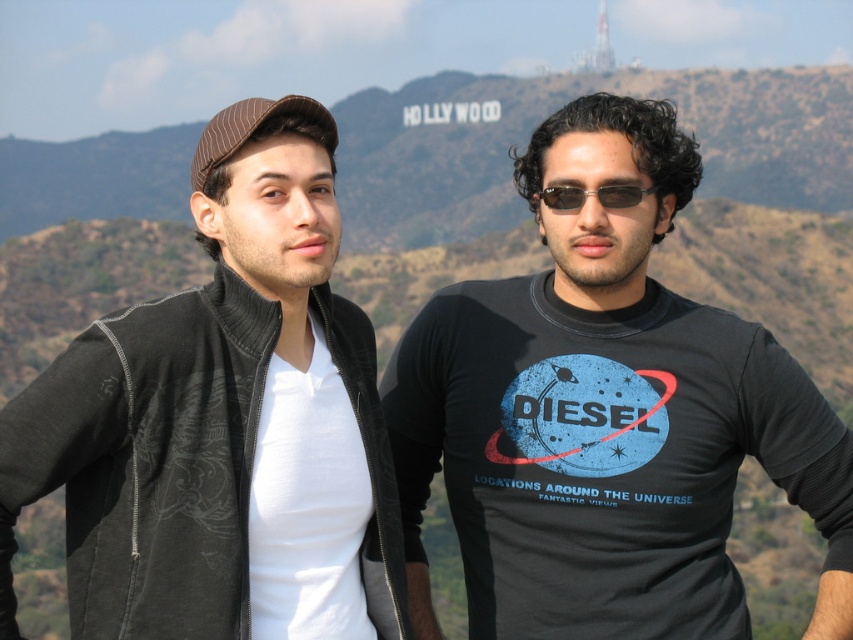
Question: Can you confirm if brownmaterialmountain at upper center is positioned below sunglasses at center?

Choices:
 (A) no
 (B) yes

Answer: (A)

Question: Which object is positioned farthest from the white matte t-shirt at left?

Choices:
 (A) black matte t-shirt at center
 (B) matte black jacket at left
 (C) sunglasses at center

Answer: (C)

Question: Is matte black jacket at left closer to the viewer compared to brownmaterialmountain at upper center?

Choices:
 (A) yes
 (B) no

Answer: (A)

Question: Which point is farther from the camera taking this photo?

Choices:
 (A) (332, 608)
 (B) (213, 557)
 (C) (605, 198)
 (D) (375, 196)

Answer: (D)

Question: Which point is closer to the camera?

Choices:
 (A) white matte t-shirt at left
 (B) matte black jacket at left
 (C) black matte t-shirt at center
 (D) brownmaterialmountain at upper center

Answer: (B)

Question: Does matte black jacket at left appear over white matte t-shirt at left?

Choices:
 (A) yes
 (B) no

Answer: (A)